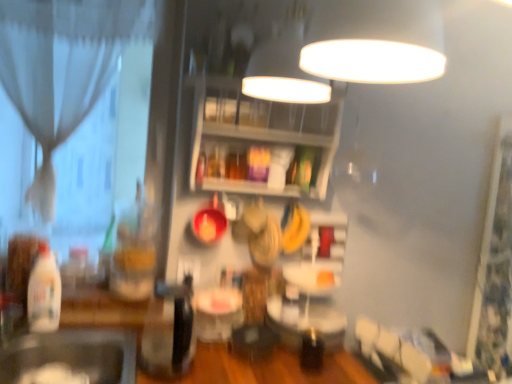
Question: Is the position of black matte sink at lower left less distant than that of translucent plastic bottle at left, acting as the 2th bottle starting from the back?

Choices:
 (A) yes
 (B) no

Answer: (A)

Question: Is black matte sink at lower left bigger than translucent plastic bottle at left, the second bottle from the right?

Choices:
 (A) no
 (B) yes

Answer: (B)

Question: Is black matte sink at lower left to the left of translucent plastic bottle at left, acting as the 2th bottle starting from the back, from the viewer's perspective?

Choices:
 (A) no
 (B) yes

Answer: (A)

Question: Is black matte sink at lower left facing away from translucent plastic bottle at left, the 1th bottle from the front?

Choices:
 (A) no
 (B) yes

Answer: (A)

Question: Considering the relative sizes of black matte sink at lower left and translucent plastic bottle at left, the second bottle from the right, in the image provided, is black matte sink at lower left shorter than translucent plastic bottle at left, the second bottle from the right,?

Choices:
 (A) no
 (B) yes

Answer: (B)

Question: Could you tell me if black matte sink at lower left is turned towards translucent plastic bottle at left, the 1th bottle from the front?

Choices:
 (A) no
 (B) yes

Answer: (A)

Question: Can you confirm if white glossy table at center is positioned to the right of wooden shelves at upper center?

Choices:
 (A) no
 (B) yes

Answer: (A)

Question: Does white glossy table at center have a greater height compared to wooden shelves at upper center?

Choices:
 (A) yes
 (B) no

Answer: (B)

Question: Does white glossy table at center appear on the left side of wooden shelves at upper center?

Choices:
 (A) no
 (B) yes

Answer: (B)

Question: Is wooden shelves at upper center at the back of white glossy table at center?

Choices:
 (A) yes
 (B) no

Answer: (B)

Question: Would you consider white glossy table at center to be distant from wooden shelves at upper center?

Choices:
 (A) yes
 (B) no

Answer: (B)

Question: Can you confirm if white glossy table at center is smaller than wooden shelves at upper center?

Choices:
 (A) yes
 (B) no

Answer: (A)

Question: Is translucent glass jar at center, marked as the 1th bottle in a back-to-front arrangement, closer to the viewer compared to white glossy table at center?

Choices:
 (A) yes
 (B) no

Answer: (B)